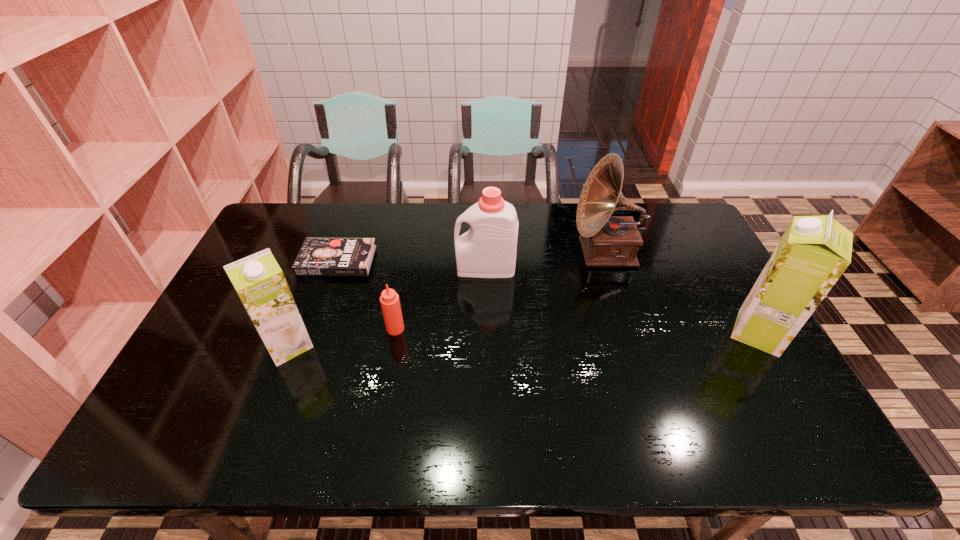
Locate an element on the screen. free spot at the far edge of the desktop is located at coordinates (353, 233).

Locate an element on the screen. This screenshot has height=540, width=960. blank area at the near edge is located at coordinates (313, 410).

The image size is (960, 540). I want to click on vacant space at the far right corner, so click(x=696, y=234).

The width and height of the screenshot is (960, 540). Find the location of `free space between the shorter soya milk and the book`. free space between the shorter soya milk and the book is located at coordinates (313, 302).

Find the location of a particular element. blank region between the shorter soya milk and the phonograph record is located at coordinates (447, 299).

This screenshot has height=540, width=960. Find the location of `free space that is in between the book and the taller soya milk`. free space that is in between the book and the taller soya milk is located at coordinates (547, 296).

You are a GUI agent. You are given a task and a screenshot of the screen. Output one action in this format:
    pyautogui.click(x=<x>, y=<y>)
    Task: Click on the free area in between the Tabasco sauce and the second object from right to left
    This screenshot has height=540, width=960.
    Given the screenshot: What is the action you would take?
    pyautogui.click(x=501, y=291)

The height and width of the screenshot is (540, 960). I want to click on free space that is in between the third object from right to left and the rightmost object, so click(622, 300).

What are the coordinates of `free space between the left soya milk and the fourth object from right to left` in the screenshot? It's located at (342, 337).

At what (x,y) coordinates should I click in order to perform the action: click on vacant point located between the Tabasco sauce and the fourth object from left to right. Please return your answer as a coordinate pair (x, y). The image size is (960, 540). Looking at the image, I should click on 441,298.